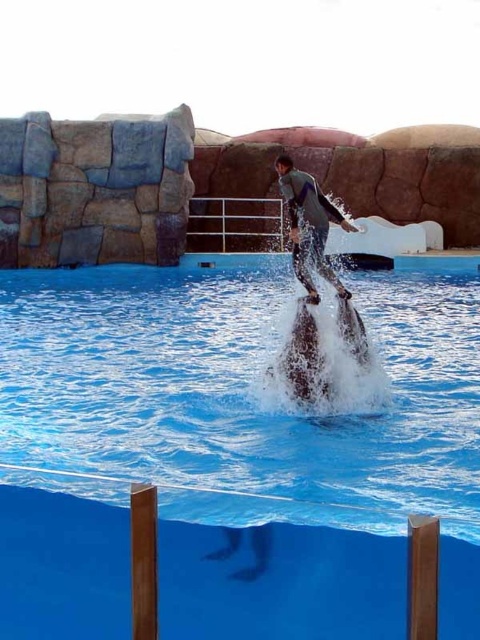
Question: From the image, what is the correct spatial relationship of gray matte wetsuit at center in relation to black glossy dolphin at center?

Choices:
 (A) above
 (B) below

Answer: (A)

Question: Can you confirm if gray matte wetsuit at center is bigger than smooth gray dolphin at center?

Choices:
 (A) yes
 (B) no

Answer: (A)

Question: Is blue smooth water at center wider than smooth gray dolphin at center?

Choices:
 (A) no
 (B) yes

Answer: (B)

Question: Which of the following is the closest to the observer?

Choices:
 (A) smooth gray dolphin at center
 (B) blue smooth water at center
 (C) black glossy dolphin at center
 (D) gray matte wetsuit at center

Answer: (B)

Question: Which point is closer to the camera?

Choices:
 (A) gray matte wetsuit at center
 (B) black glossy dolphin at center
 (C) blue smooth water at center
 (D) smooth gray dolphin at center

Answer: (C)

Question: Which of the following is the closest to the observer?

Choices:
 (A) (277, 362)
 (B) (133, 291)
 (C) (354, 340)
 (D) (299, 211)

Answer: (D)